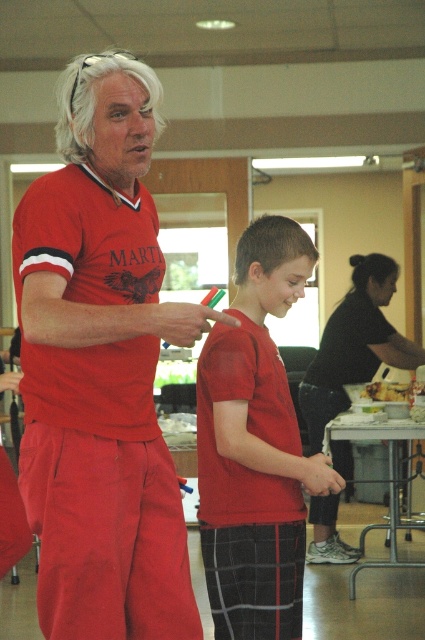
Where is the matte red shirt at center located in the image?

The matte red shirt at center is located at point (101, 369) in the image.

You are standing in the communal area and notice two points marked on the floor. The first point is at coordinates point [90,486] and the second is at point [283,488]. If you want to reach the point that is closer to you, which coordinate should you go to?

The point at coordinates point [90,486] is closer to the viewer, so you should go to point [90,486].